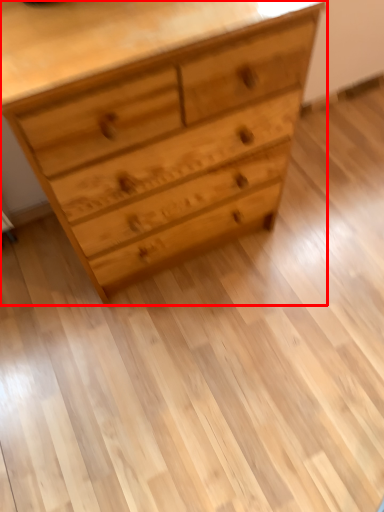
Question: From the image, what is the correct spatial relationship of chest of drawers (annotated by the red box) in relation to drawer?

Choices:
 (A) left
 (B) right

Answer: (A)